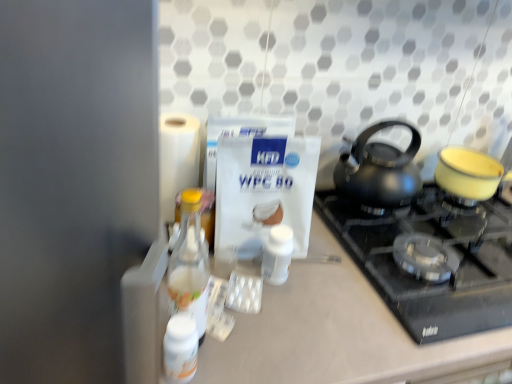
Question: From the image's perspective, would you say black glass gas stove at center is shown under white matte toilet paper at left?

Choices:
 (A) yes
 (B) no

Answer: (A)

Question: Is black glass gas stove at center positioned beyond the bounds of white matte toilet paper at left?

Choices:
 (A) yes
 (B) no

Answer: (A)

Question: Is black glass gas stove at center facing away from white matte toilet paper at left?

Choices:
 (A) yes
 (B) no

Answer: (B)

Question: Are black glass gas stove at center and white matte toilet paper at left beside each other?

Choices:
 (A) yes
 (B) no

Answer: (B)

Question: Is black glass gas stove at center positioned in front of white matte toilet paper at left?

Choices:
 (A) yes
 (B) no

Answer: (A)

Question: Is black glass gas stove at center positioned behind white matte toilet paper at left?

Choices:
 (A) no
 (B) yes

Answer: (A)

Question: Are white glossy bottle at lower left, which ranks as the 2th bottle in back-to-front order, and white matte toilet paper at left making contact?

Choices:
 (A) yes
 (B) no

Answer: (B)

Question: Does white glossy bottle at lower left, the first bottle from the left, lie in front of white matte toilet paper at left?

Choices:
 (A) no
 (B) yes

Answer: (B)

Question: Could you tell me if white glossy bottle at lower left, which ranks as the 2th bottle in back-to-front order, is turned towards white matte toilet paper at left?

Choices:
 (A) no
 (B) yes

Answer: (A)

Question: Considering the relative sizes of white glossy bottle at lower left, the second bottle positioned from the front, and white matte toilet paper at left in the image provided, is white glossy bottle at lower left, the second bottle positioned from the front, smaller than white matte toilet paper at left?

Choices:
 (A) no
 (B) yes

Answer: (B)

Question: Does white glossy bottle at lower left, the 3th bottle in the right-to-left sequence, have a greater height compared to white matte toilet paper at left?

Choices:
 (A) yes
 (B) no

Answer: (B)

Question: Is clear glass bottle at left, the second bottle in the right-to-left sequence, in front of black matte kettle at upper right?

Choices:
 (A) no
 (B) yes

Answer: (B)